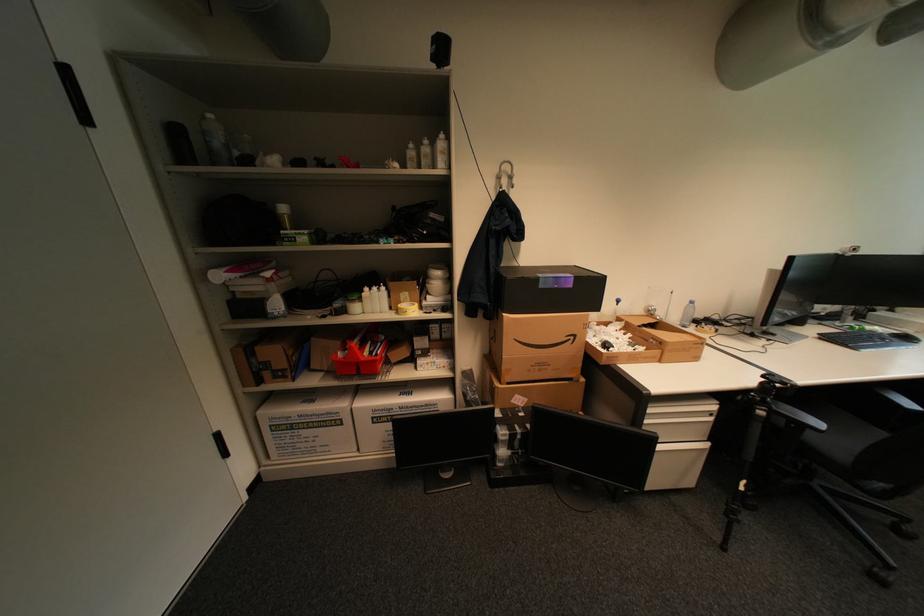
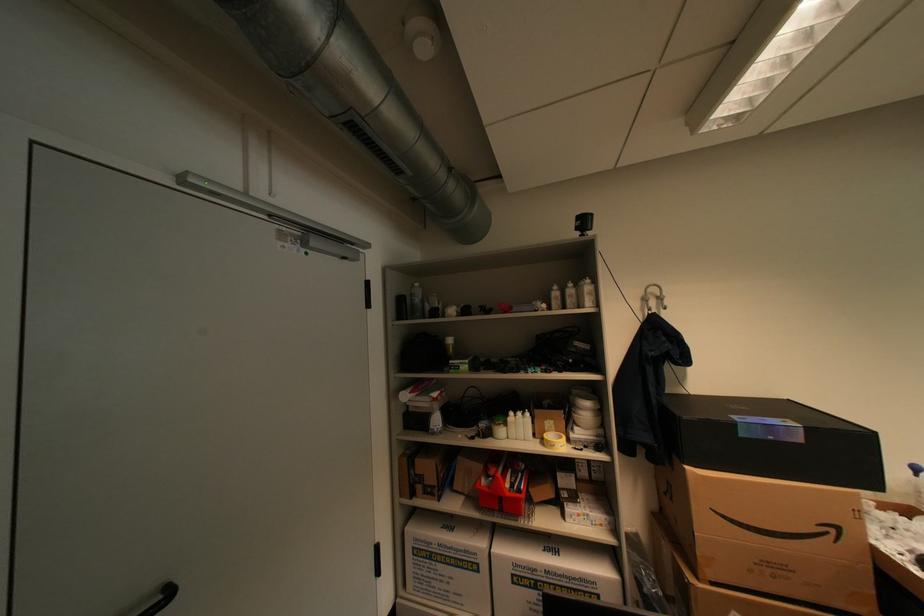
Find the pixel in the second image that matches (x=405, y=166) in the first image.

(553, 306)